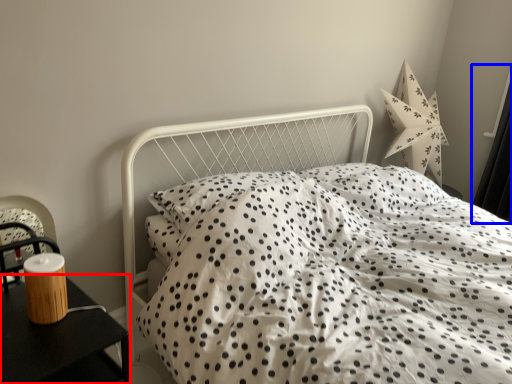
Question: Which of the following is the farthest to the observer, nightstand (highlighted by a red box) or curtain (highlighted by a blue box)?

Choices:
 (A) nightstand
 (B) curtain

Answer: (B)